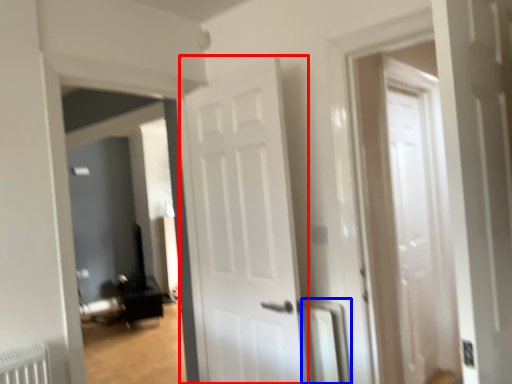
Question: Among these objects, which one is farthest to the camera, door (highlighted by a red box) or radiator (highlighted by a blue box)?

Choices:
 (A) door
 (B) radiator

Answer: (B)